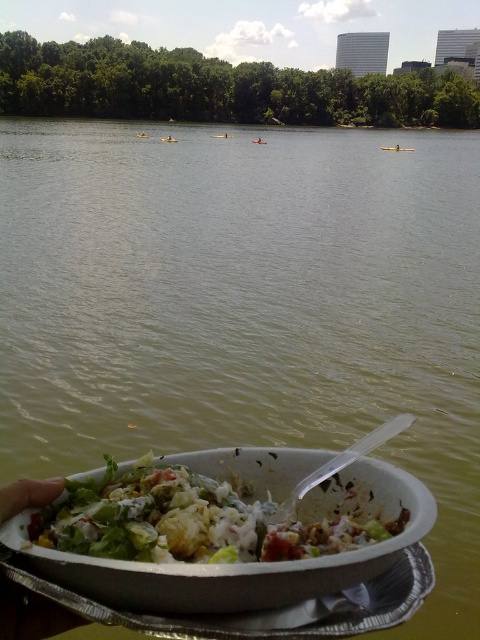
Question: Considering the real-world distances, which object is farthest from the metallic gold kayak at center?

Choices:
 (A) yellow plastic kayak at center
 (B) fresh green salad at lower center

Answer: (B)

Question: Considering the relative positions of fresh green salad at lower center and yellow plastic kayak at center in the image provided, where is fresh green salad at lower center located with respect to yellow plastic kayak at center?

Choices:
 (A) above
 (B) below

Answer: (B)

Question: Is fresh green salad at lower center below metallic gold kayak at center?

Choices:
 (A) no
 (B) yes

Answer: (B)

Question: Which point is farther to the camera?

Choices:
 (A) pyautogui.click(x=288, y=531)
 (B) pyautogui.click(x=396, y=147)
 (C) pyautogui.click(x=176, y=140)

Answer: (B)

Question: Which point is farther from the camera taking this photo?

Choices:
 (A) [386, 148]
 (B) [97, 515]

Answer: (A)

Question: Is fresh green salad at lower center positioned at the back of yellow plastic kayak at center?

Choices:
 (A) yes
 (B) no

Answer: (B)